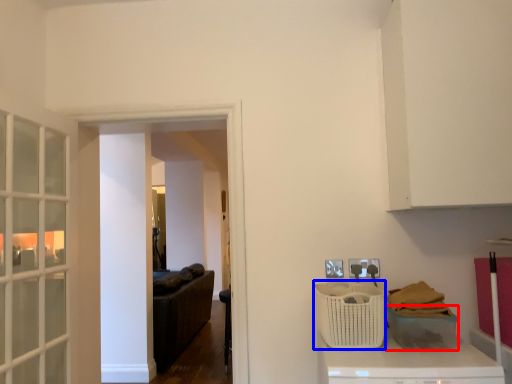
Question: Which of the following is the farthest to the observer, basket (highlighted by a red box) or basket (highlighted by a blue box)?

Choices:
 (A) basket
 (B) basket

Answer: (B)